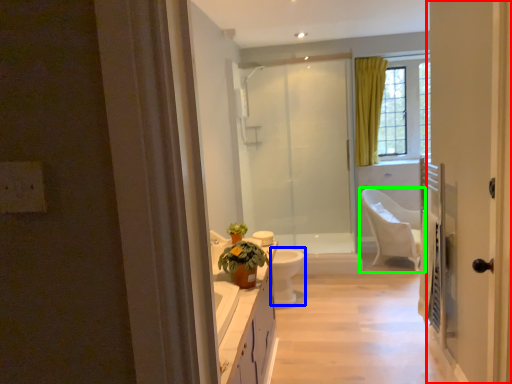
Question: Estimate the real-world distances between objects in this image. Which object is farther from door (highlighted by a red box), toilet bowl (highlighted by a blue box) or chair (highlighted by a green box)?

Choices:
 (A) toilet bowl
 (B) chair

Answer: (B)